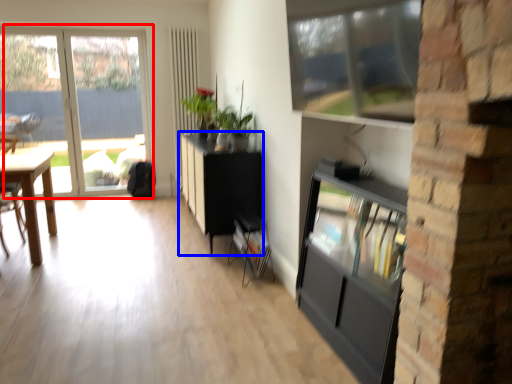
Question: Which object appears farthest to the camera in this image, window (highlighted by a red box) or cabinetry (highlighted by a blue box)?

Choices:
 (A) window
 (B) cabinetry

Answer: (A)